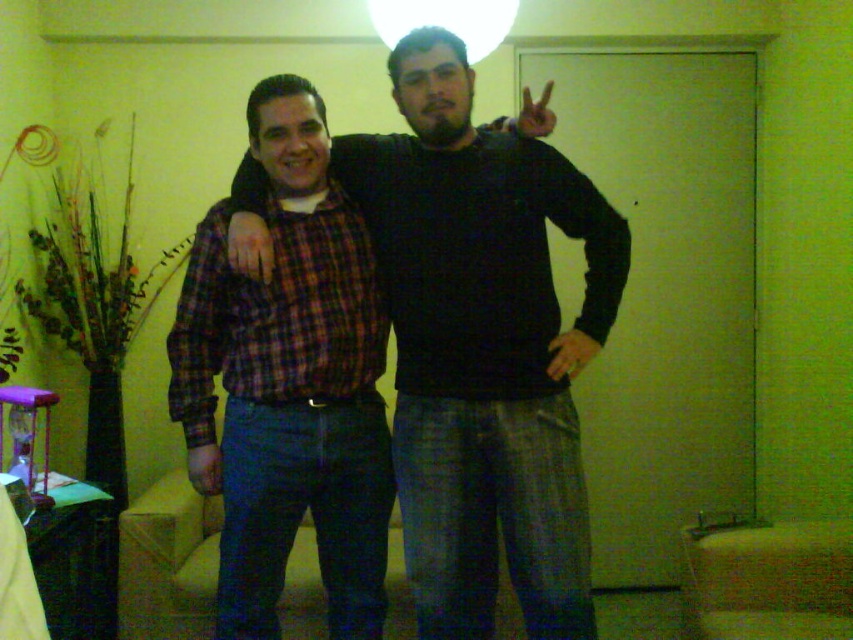
Question: Can you confirm if plaid fabric shirt at center is wider than white matte lampshade at upper center?

Choices:
 (A) yes
 (B) no

Answer: (A)

Question: Among these objects, which one is nearest to the camera?

Choices:
 (A) plaid fabric shirt at center
 (B) white matte lampshade at upper center

Answer: (A)

Question: Does plaid fabric shirt at center appear under white matte lampshade at upper center?

Choices:
 (A) no
 (B) yes

Answer: (B)

Question: Is plaid fabric shirt at center further to camera compared to white matte lampshade at upper center?

Choices:
 (A) yes
 (B) no

Answer: (B)